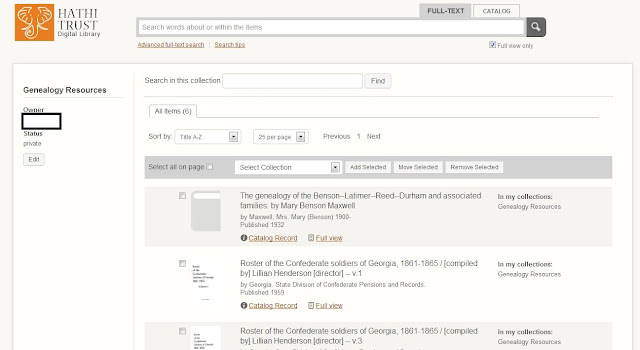
Where is `catalog box`? The width and height of the screenshot is (640, 350). catalog box is located at coordinates [493, 8].